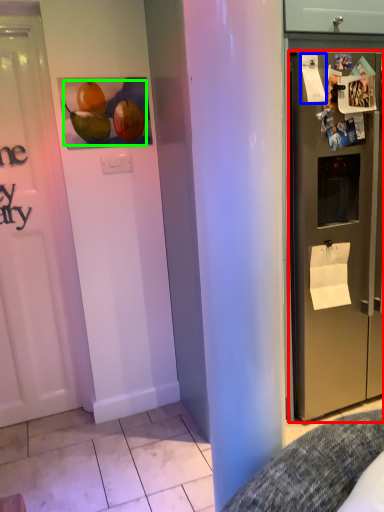
Question: Considering the real-world distances, which object is closest to refrigerator (highlighted by a red box)? paper (highlighted by a blue box) or fruit (highlighted by a green box).

Choices:
 (A) paper
 (B) fruit

Answer: (A)